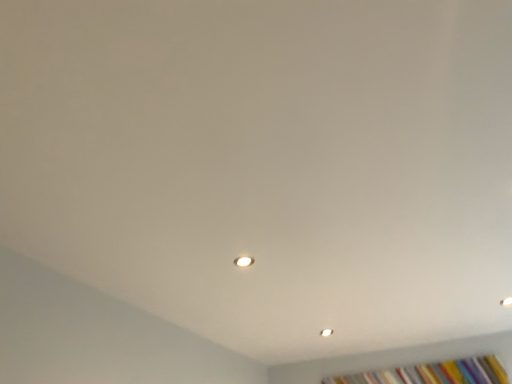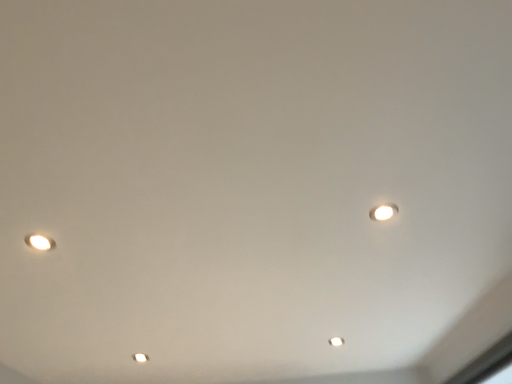
Question: How did the camera likely rotate when shooting the video?

Choices:
 (A) rotated left
 (B) rotated right

Answer: (B)